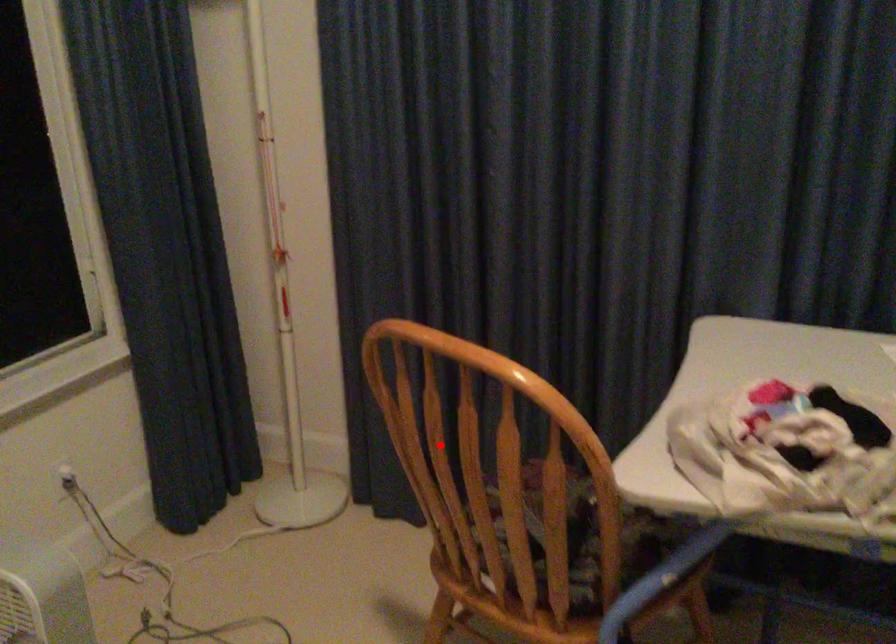
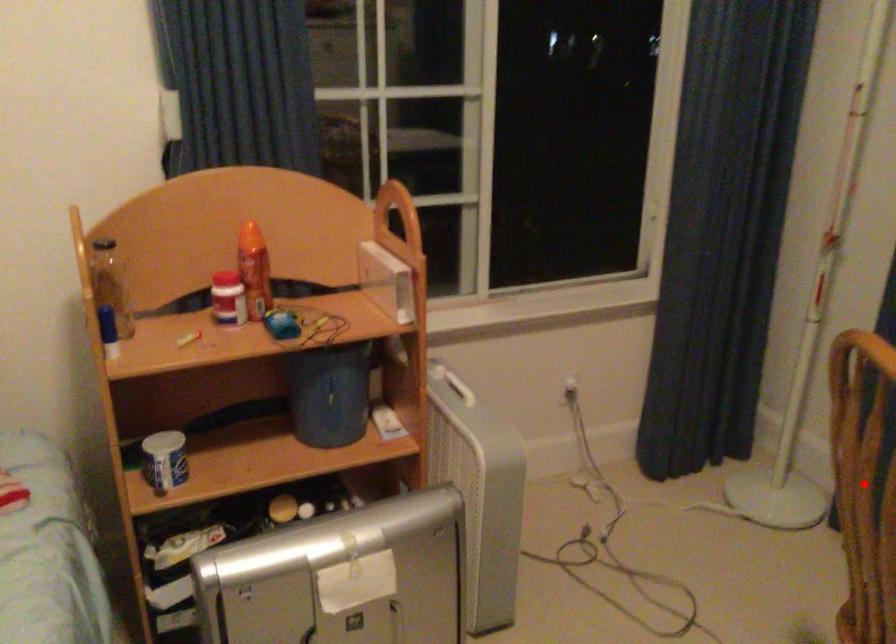
I am providing you with two images of the same scene from different viewpoints. A red point is marked on the first image and another point is marked on the second image. Do the highlighted points in image1 and image2 indicate the same real-world spot?

Yes